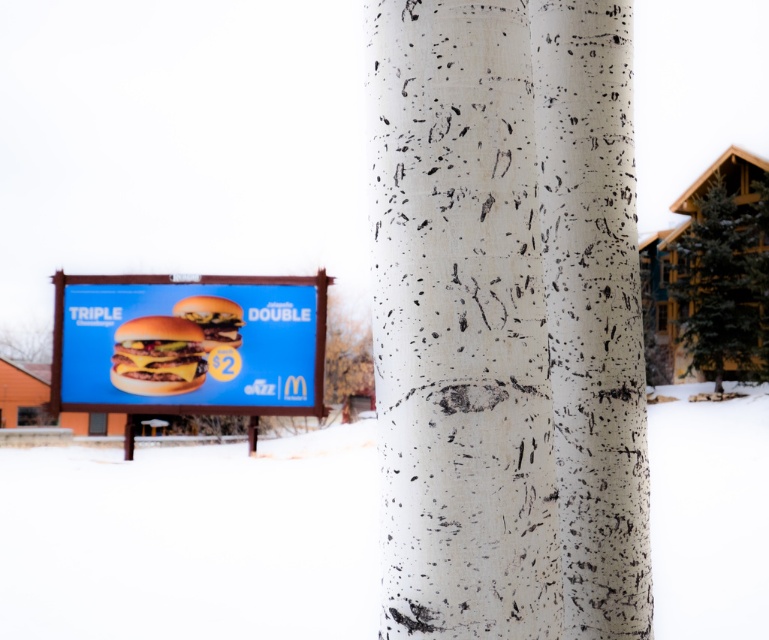
Question: Is cheeseburger with melted cheese at center behind golden-brown crispy hamburger at center?

Choices:
 (A) no
 (B) yes

Answer: (B)

Question: Which of the following is the farthest from the observer?

Choices:
 (A) (132, 593)
 (B) (222, 310)
 (C) (127, 346)
 (D) (170, 288)

Answer: (D)

Question: Which point is closer to the camera?

Choices:
 (A) white powdery snow at lower center
 (B) golden-brown crispy hamburger at center
 (C) blue cardboard billboard at center

Answer: (A)

Question: Is cheeseburger with melted cheese at center closer to camera compared to golden-brown crispy hamburger at center?

Choices:
 (A) no
 (B) yes

Answer: (A)

Question: Estimate the real-world distances between objects in this image. Which object is closer to the golden-brown crispy hamburger at center?

Choices:
 (A) blue cardboard billboard at center
 (B) white powdery snow at lower center
 (C) cheeseburger with melted cheese at center

Answer: (C)

Question: Can you confirm if white powdery snow at lower center is positioned to the right of cheeseburger with melted cheese at center?

Choices:
 (A) yes
 (B) no

Answer: (A)